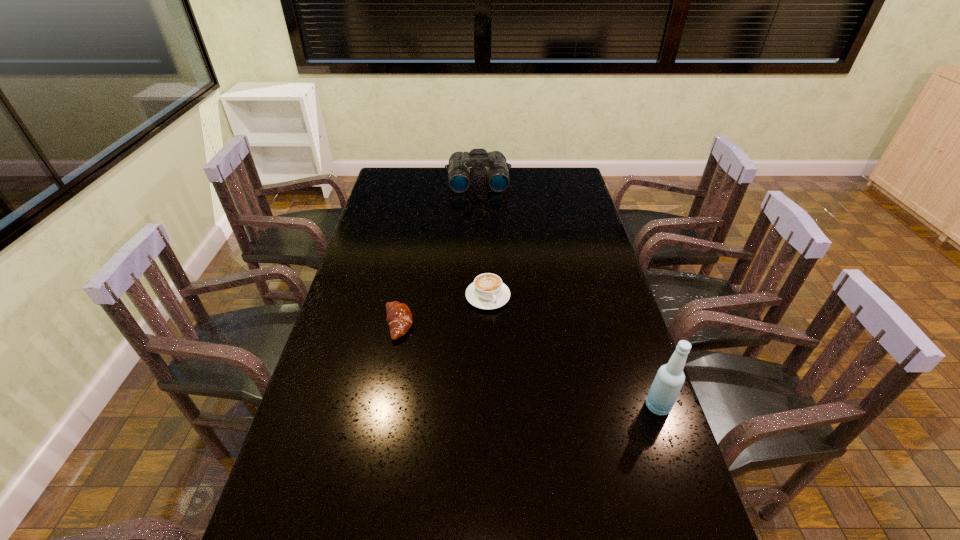
You are a GUI agent. You are given a task and a screenshot of the screen. Output one action in this format:
    pyautogui.click(x=<x>, y=<y>)
    Task: Click on the leftmost object
    This screenshot has height=540, width=960.
    Given the screenshot: What is the action you would take?
    pyautogui.click(x=399, y=318)

The width and height of the screenshot is (960, 540). I want to click on crescent roll, so click(x=399, y=318).

At what (x,y) coordinates should I click in order to perform the action: click on the nearest object. Please return your answer as a coordinate pair (x, y). This screenshot has width=960, height=540. Looking at the image, I should click on (670, 377).

Where is `the tallest object`? This screenshot has height=540, width=960. the tallest object is located at coordinates [670, 377].

Locate an element on the screen. binoculars is located at coordinates (498, 178).

Locate an element on the screen. This screenshot has width=960, height=540. the third shortest object is located at coordinates (498, 178).

Where is `cappuccino`? The width and height of the screenshot is (960, 540). cappuccino is located at coordinates (487, 291).

This screenshot has height=540, width=960. I want to click on vacant point located 0.350m on the front of the leftmost object, so click(x=373, y=456).

Where is `vacant region located on the left of the tallest object`? This screenshot has height=540, width=960. vacant region located on the left of the tallest object is located at coordinates click(x=626, y=406).

Where is `blank space located through the lenses of the third shortest object`? blank space located through the lenses of the third shortest object is located at coordinates (483, 237).